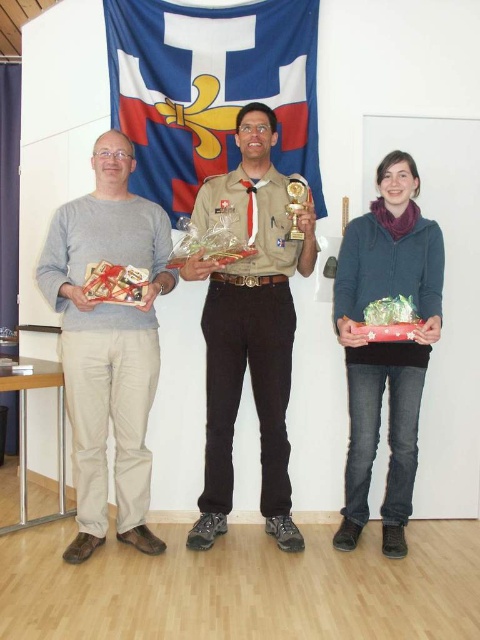
Does blue fabric flag at upper center come in front of brown uniform at center?

No, it is not.

How far apart are blue fabric flag at upper center and brown uniform at center?

blue fabric flag at upper center and brown uniform at center are 22.89 inches apart from each other.

Is point (205, 125) less distant than point (248, 140)?

No, it is not.

At what (x,y) coordinates should I click in order to perform the action: click on blue fabric flag at upper center. Please return your answer as a coordinate pair (x, y). Image resolution: width=480 pixels, height=640 pixels. Looking at the image, I should click on (211, 90).

Which of these two, gray matte sweater at left or gold metallic trophy at center, stands shorter?

With less height is gold metallic trophy at center.

Is gray matte sweater at left above gold metallic trophy at center?

No.

Locate an element on the screen. gray matte sweater at left is located at coordinates (108, 344).

In the scene shown: Between matte gray sweater at center and matte blue sweater at center, which one appears on the right side from the viewer's perspective?

matte blue sweater at center

Is matte gray sweater at center wider than matte blue sweater at center?

Correct, the width of matte gray sweater at center exceeds that of matte blue sweater at center.

Which is behind, point (75, 337) or point (368, 234)?

Positioned behind is point (368, 234).

Image resolution: width=480 pixels, height=640 pixels. In order to click on matte gray sweater at center in this screenshot , I will do `click(250, 326)`.